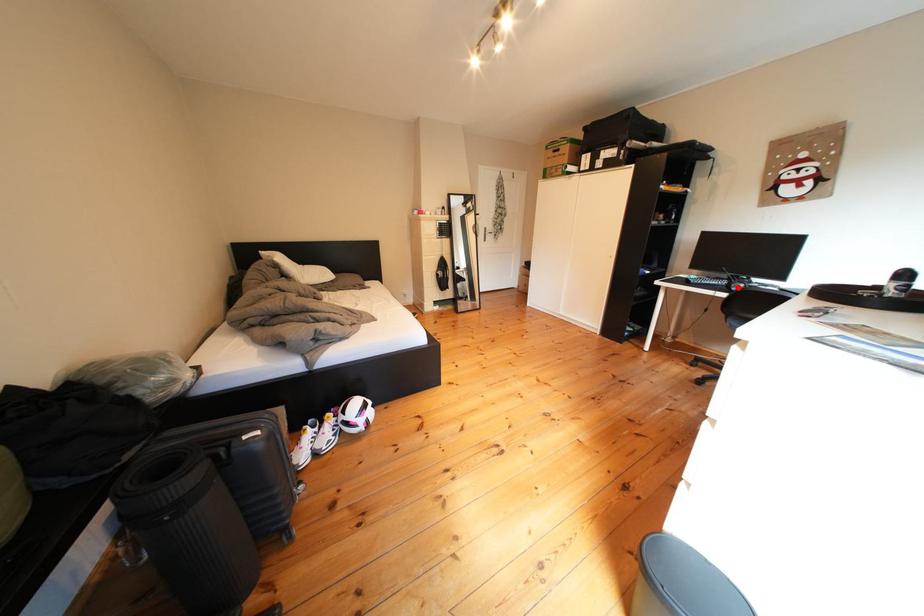
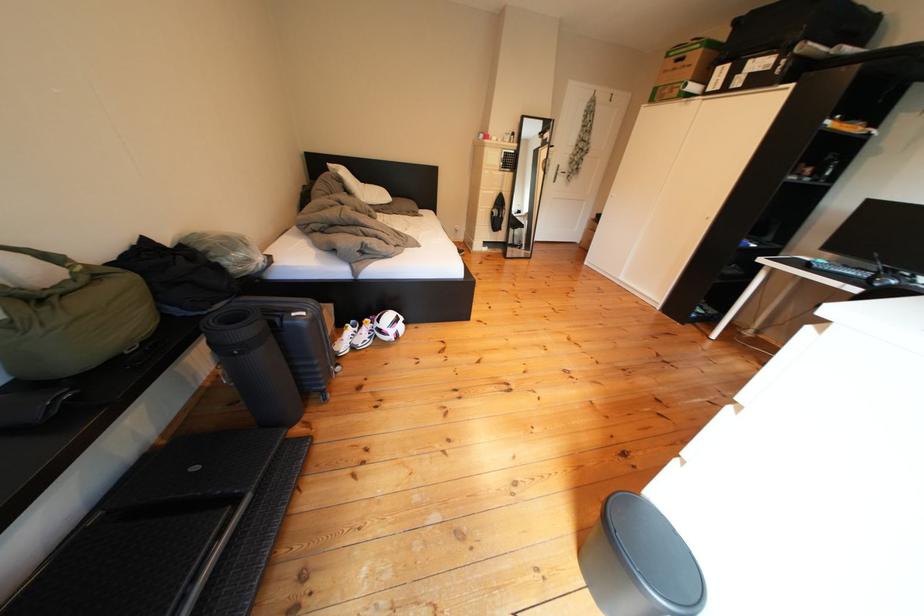
In the second image, find the point that corresponds to the highlighted location in the first image.

(880, 278)